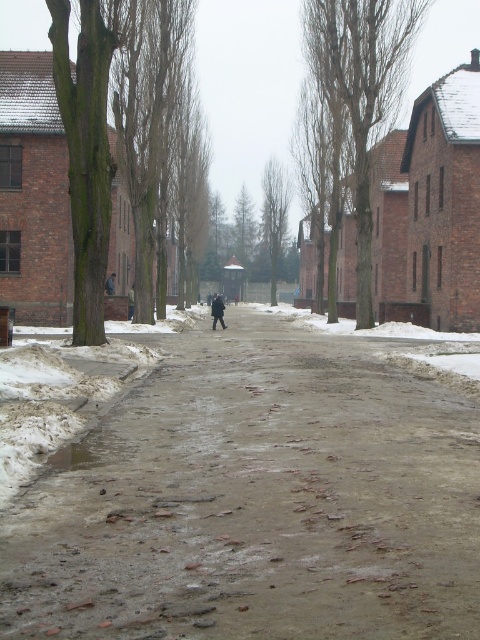
Is dull concrete pavement at center positioned at the back of dark gray wool coat at center?

No, dull concrete pavement at center is closer to the viewer.

Can you confirm if dull concrete pavement at center is positioned below dark gray wool coat at center?

Indeed, dull concrete pavement at center is positioned under dark gray wool coat at center.

Between point (269, 532) and point (218, 310), which one is positioned behind?

Point (218, 310)

At what (x,y) coordinates should I click in order to perform the action: click on dull concrete pavement at center. Please return your answer as a coordinate pair (x, y). The height and width of the screenshot is (640, 480). Looking at the image, I should click on (256, 500).